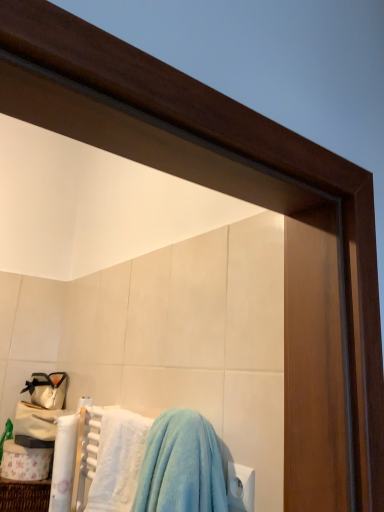
Measure the distance between light blue soft towel at lower left and camera.

They are 3.34 feet apart.

You are a GUI agent. You are given a task and a screenshot of the screen. Output one action in this format:
    pyautogui.click(x=<x>, y=<y>)
    Task: Click on the light blue soft towel at lower left
    
    Given the screenshot: What is the action you would take?
    pyautogui.click(x=118, y=461)

Describe the element at coordinates (118, 461) in the screenshot. This screenshot has width=384, height=512. I see `light blue soft towel at lower left` at that location.

The image size is (384, 512). In order to click on light blue soft towel at lower left in this screenshot , I will do click(118, 461).